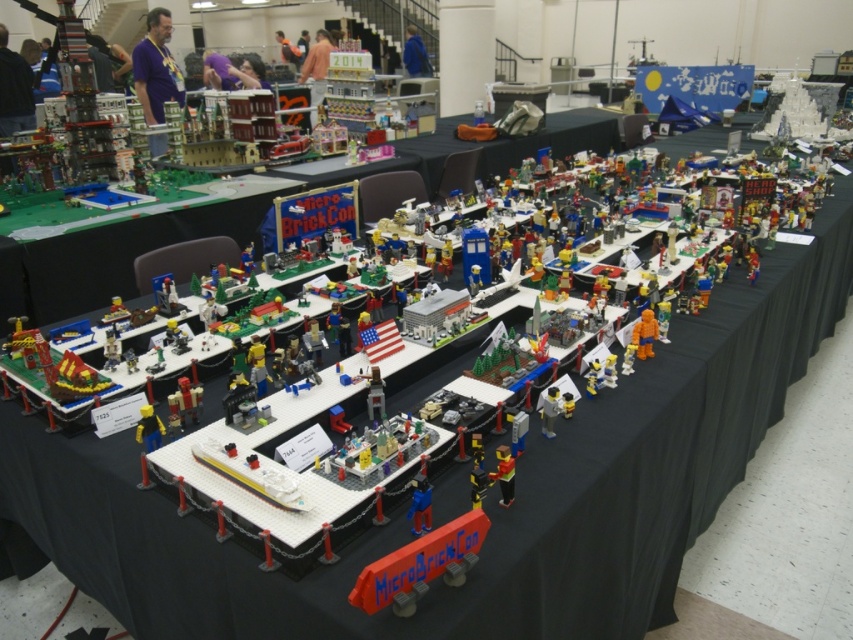
Question: Which point appears closest to the camera in this image?

Choices:
 (A) (260, 372)
 (B) (149, 413)

Answer: (B)

Question: Which object is positioned farthest from the black plastic minifigure at center?

Choices:
 (A) bright yellow plastic minifigure at center
 (B) white plastic minifigure at center
 (C) orange matte figure at center

Answer: (C)

Question: Does orange matte figure at center appear on the right side of black plastic minifigure at center?

Choices:
 (A) no
 (B) yes

Answer: (B)

Question: Observing the image, what is the correct spatial positioning of yellow matte figure at center in reference to black plastic minifigure at center?

Choices:
 (A) right
 (B) left

Answer: (B)

Question: Which of these objects is positioned closest to the black plastic minifigure at center?

Choices:
 (A) blue plastic figure at center
 (B) translucent plastic minifigure at center
 (C) bright yellow plastic minifigure at center
 (D) yellow matte figure at center

Answer: (C)

Question: Does white plastic minifigure at center have a larger size compared to black plastic minifigure at center?

Choices:
 (A) no
 (B) yes

Answer: (A)